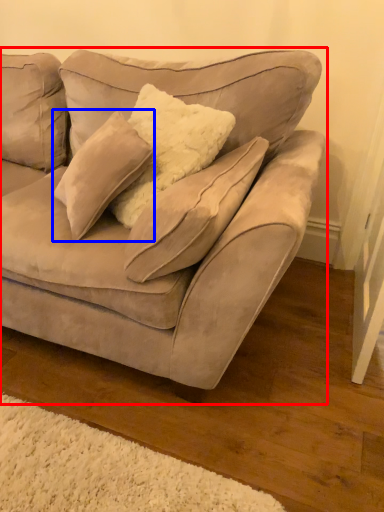
Question: Which object appears farthest to the camera in this image, studio couch (highlighted by a red box) or pillow (highlighted by a blue box)?

Choices:
 (A) studio couch
 (B) pillow

Answer: (B)